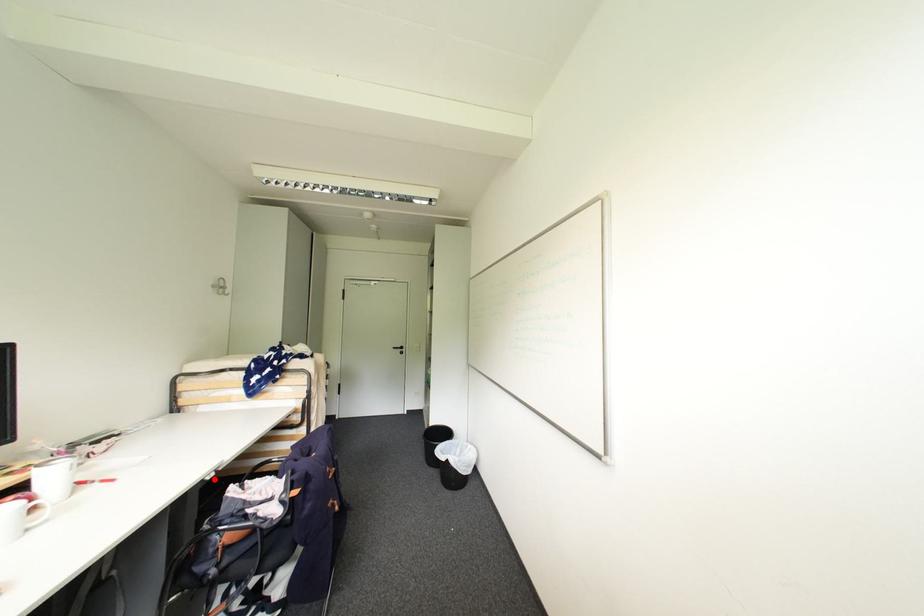
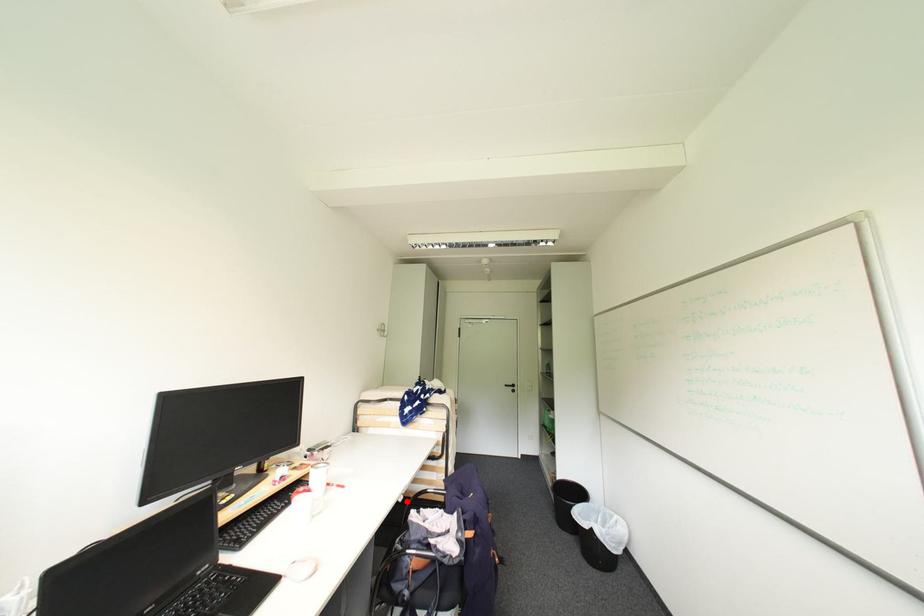
I am providing you with two images of the same scene from different viewpoints. A red point is marked on the first image and another point is marked on the second image. Is the red point in image1 aligned with the point shown in image2?

Yes